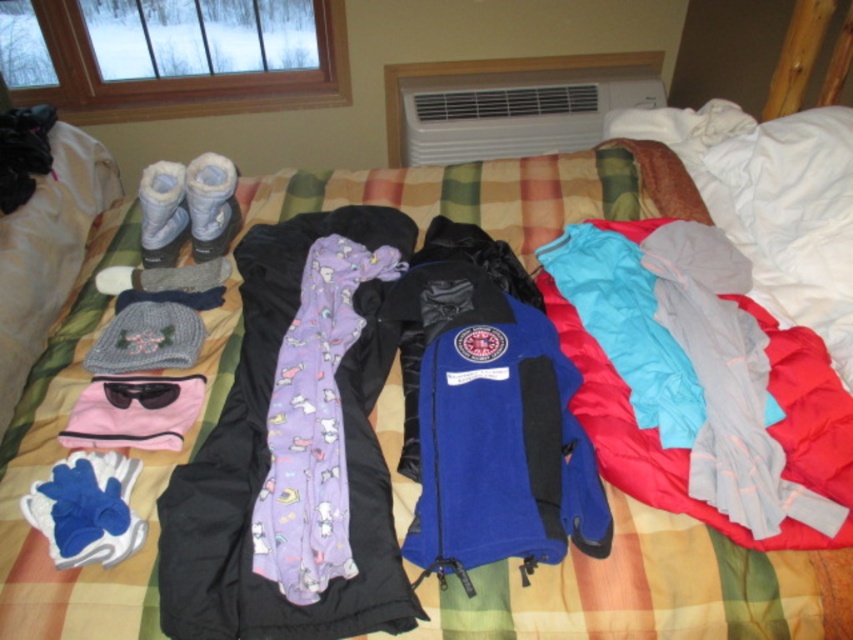
You are organizing winter clothing on a bed with a plaid blanket. You have a purple fleece scarf at center and a light blue fabric at center. According to the arrangement, which item is placed above the other?

The light blue fabric at center is placed above the purple fleece scarf at center because the purple fleece scarf at center is positioned under it.

You are packing a backpack for a winter hike and need to decide whether the light blue fabric at center and the blue fleece jacket at center can be placed side by side without overlapping. The backpack compartment has a width of 18 centimeters. Can both items fit together in the compartment?

The distance between the light blue fabric at center and the blue fleece jacket at center is 16.29 centimeters. Since the backpack compartment is 18 centimeters wide, which is wider than the combined space they require, both items can fit side by side without overlapping.

You are packing a suitcase and need to decide whether the light blue fabric at center can be folded and placed under the blue fleece jacket at center. Based on their sizes, is this possible?

The light blue fabric at center is much taller than the blue fleece jacket at center, so it might not fold small enough to fit under the jacket without overlapping or requiring excessive folding.